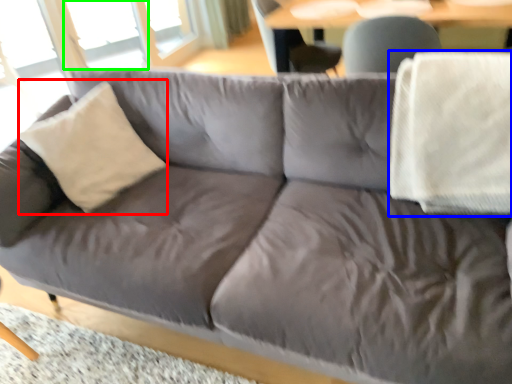
Question: Considering the real-world distances, which object is closest to throw pillow (highlighted by a red box)? blanket (highlighted by a blue box) or window (highlighted by a green box).

Choices:
 (A) blanket
 (B) window

Answer: (A)